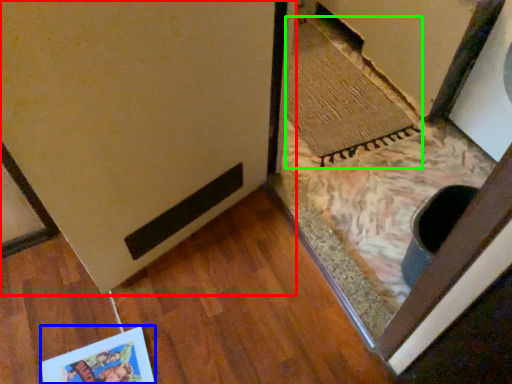
Question: Which is farther away from door (highlighted by a red box)? postcard (highlighted by a blue box) or doormat (highlighted by a green box)?

Choices:
 (A) postcard
 (B) doormat

Answer: (B)